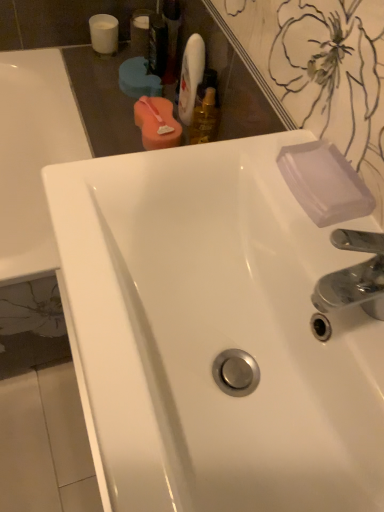
Question: Should I look upward or downward to see white glossy sink at center?

Choices:
 (A) up
 (B) down

Answer: (B)

Question: Can you see clear plastic bottle at upper center, the second mouthwash from the left, touching white glossy sink at center?

Choices:
 (A) yes
 (B) no

Answer: (B)

Question: Considering the relative sizes of clear plastic bottle at upper center, which is counted as the fifth mouthwash, starting from the right, and white glossy sink at center in the image provided, is clear plastic bottle at upper center, which is counted as the fifth mouthwash, starting from the right, bigger than white glossy sink at center?

Choices:
 (A) yes
 (B) no

Answer: (B)

Question: Is clear plastic bottle at upper center, which is counted as the fifth mouthwash, starting from the right, positioned behind white glossy sink at center?

Choices:
 (A) no
 (B) yes

Answer: (B)

Question: Can you confirm if clear plastic bottle at upper center, the second mouthwash from the left, is positioned to the right of white glossy sink at center?

Choices:
 (A) no
 (B) yes

Answer: (A)

Question: From a real-world perspective, is clear plastic bottle at upper center, which is counted as the fifth mouthwash, starting from the right, physically above white glossy sink at center?

Choices:
 (A) no
 (B) yes

Answer: (B)

Question: Does clear plastic bottle at upper center, which is counted as the fifth mouthwash, starting from the right, have a smaller size compared to white glossy sink at center?

Choices:
 (A) no
 (B) yes

Answer: (B)

Question: From a real-world perspective, is gold metallic mouthwash at upper center, which is the 1th mouthwash from right to left, below white matte cup at upper left, positioned as the sixth mouthwash in right-to-left order?

Choices:
 (A) yes
 (B) no

Answer: (B)

Question: Is gold metallic mouthwash at upper center, which is the sixth mouthwash from left to right, in front of white matte cup at upper left, positioned as the sixth mouthwash in right-to-left order?

Choices:
 (A) no
 (B) yes

Answer: (B)

Question: From the image's perspective, is gold metallic mouthwash at upper center, which is the 1th mouthwash from right to left, below white matte cup at upper left, positioned as the sixth mouthwash in right-to-left order?

Choices:
 (A) yes
 (B) no

Answer: (A)

Question: Could you tell me if gold metallic mouthwash at upper center, which is the 1th mouthwash from right to left, is turned towards white matte cup at upper left, the first mouthwash in the left-to-right sequence?

Choices:
 (A) yes
 (B) no

Answer: (B)

Question: Can you confirm if gold metallic mouthwash at upper center, which is the 1th mouthwash from right to left, is shorter than white matte cup at upper left, the first mouthwash in the left-to-right sequence?

Choices:
 (A) yes
 (B) no

Answer: (B)

Question: Is gold metallic mouthwash at upper center, which is the sixth mouthwash from left to right, facing away from white matte cup at upper left, positioned as the sixth mouthwash in right-to-left order?

Choices:
 (A) yes
 (B) no

Answer: (B)

Question: Does translucent plastic mouthwash at upper center, placed as the 5th mouthwash when sorted from left to right, have a smaller size compared to white matte cup at upper left, the first mouthwash in the left-to-right sequence?

Choices:
 (A) yes
 (B) no

Answer: (B)